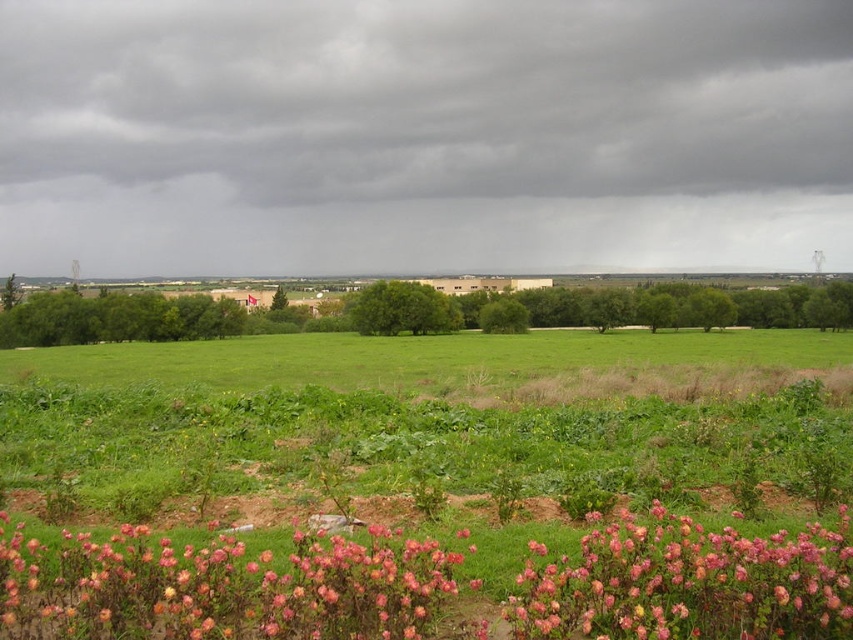
Question: Among these objects, which one is nearest to the camera?

Choices:
 (A) green grassy field at center
 (B) pink fluffy flowers at lower center
 (C) pink matte flowers at lower center

Answer: (B)

Question: Estimate the real-world distances between objects in this image. Which object is farther from the green grassy field at center?

Choices:
 (A) pink fluffy flowers at lower center
 (B) pink matte flowers at lower center

Answer: (B)

Question: Which point appears farthest from the camera in this image?

Choices:
 (A) (358, 358)
 (B) (614, 630)

Answer: (A)

Question: Is pink matte flowers at lower center above pink fluffy flowers at lower center?

Choices:
 (A) no
 (B) yes

Answer: (A)

Question: Can you confirm if pink matte flowers at lower center is positioned below pink fluffy flowers at lower center?

Choices:
 (A) yes
 (B) no

Answer: (A)

Question: Is pink matte flowers at lower center closer to the viewer compared to pink fluffy flowers at lower center?

Choices:
 (A) no
 (B) yes

Answer: (A)